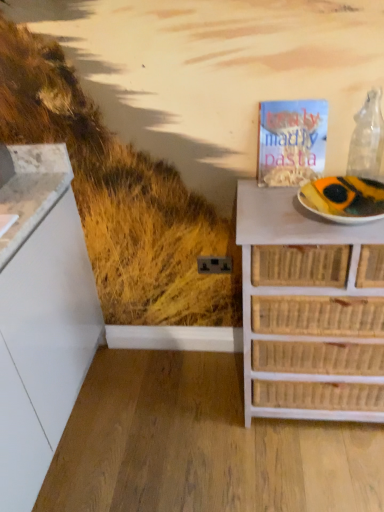
You are a GUI agent. You are given a task and a screenshot of the screen. Output one action in this format:
    pyautogui.click(x=<x>, y=<y>)
    Task: Click on the free space in front of matte paper magazine at upper right
    
    Given the screenshot: What is the action you would take?
    pyautogui.click(x=275, y=203)